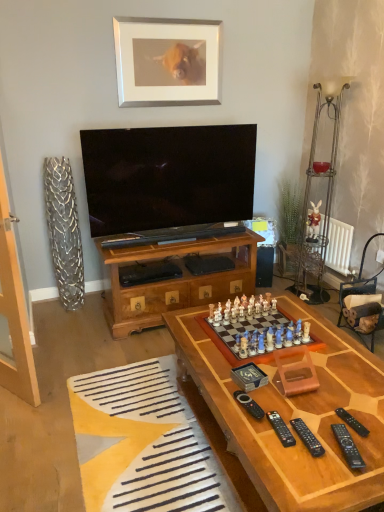
The image size is (384, 512). Identify the location of vacant area that lies between black plastic remote at lower right, the first remote when ordered from right to left, and black plastic remote at lower right, marked as the 2th remote in a right-to-left arrangement. (347, 435).